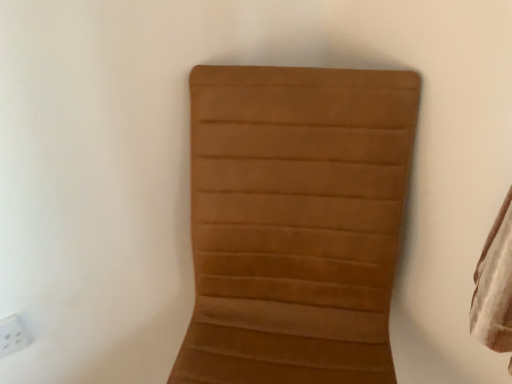
Locate an element on the screen. The image size is (512, 384). brown suede chair at center is located at coordinates (295, 222).

This screenshot has height=384, width=512. What do you see at coordinates (295, 222) in the screenshot?
I see `brown suede chair at center` at bounding box center [295, 222].

In order to click on white plastic electric outlet at lower left in this screenshot , I will do `click(13, 335)`.

The height and width of the screenshot is (384, 512). What do you see at coordinates (13, 335) in the screenshot?
I see `white plastic electric outlet at lower left` at bounding box center [13, 335].

Find the location of a particular element. brown suede chair at center is located at coordinates (295, 222).

Considering the positions of objects white plastic electric outlet at lower left and brown suede chair at center in the image provided, who is more to the right, white plastic electric outlet at lower left or brown suede chair at center?

brown suede chair at center is more to the right.

Does white plastic electric outlet at lower left come in front of brown suede chair at center?

No, it is not.

Which point is more distant from viewer, (x=4, y=343) or (x=371, y=107)?

The point (x=4, y=343) is more distant.

From the image's perspective, is white plastic electric outlet at lower left below brown suede chair at center?

No, from the image's perspective, white plastic electric outlet at lower left is not below brown suede chair at center.

From the picture: From a real-world perspective, is white plastic electric outlet at lower left above or below brown suede chair at center?

white plastic electric outlet at lower left is above brown suede chair at center.

Between white plastic electric outlet at lower left and brown suede chair at center, which one has larger width?

With larger width is brown suede chair at center.

Which of these two, white plastic electric outlet at lower left or brown suede chair at center, stands taller?

brown suede chair at center.

Considering the relative sizes of white plastic electric outlet at lower left and brown suede chair at center in the image provided, is white plastic electric outlet at lower left smaller than brown suede chair at center?

Correct, white plastic electric outlet at lower left occupies less space than brown suede chair at center.

Can we say white plastic electric outlet at lower left lies outside brown suede chair at center?

Yes, white plastic electric outlet at lower left is located beyond the bounds of brown suede chair at center.

Is white plastic electric outlet at lower left beside brown suede chair at center?

Result: No, white plastic electric outlet at lower left is not in contact with brown suede chair at center.

Could you tell me if white plastic electric outlet at lower left is facing brown suede chair at center?

No, white plastic electric outlet at lower left is not turned towards brown suede chair at center.

At what (x,y) coordinates should I click in order to perform the action: click on electric outlet on the left of brown suede chair at center. Please return your answer as a coordinate pair (x, y). The image size is (512, 384). Looking at the image, I should click on (13, 335).

Is brown suede chair at center to the right of white plastic electric outlet at lower left from the viewer's perspective?

Yes, brown suede chair at center is to the right of white plastic electric outlet at lower left.

Between brown suede chair at center and white plastic electric outlet at lower left, which one is positioned behind?

white plastic electric outlet at lower left is more distant.

Is point (277, 118) closer to viewer compared to point (12, 329)?

Yes, point (277, 118) is in front of point (12, 329).

Based on the photo, from the image's perspective, which object appears higher, brown suede chair at center or white plastic electric outlet at lower left?

white plastic electric outlet at lower left, from the image's perspective.

From a real-world perspective, is brown suede chair at center physically below white plastic electric outlet at lower left?

Yes.

Considering the relative sizes of brown suede chair at center and white plastic electric outlet at lower left in the image provided, is brown suede chair at center thinner than white plastic electric outlet at lower left?

In fact, brown suede chair at center might be wider than white plastic electric outlet at lower left.

Considering the sizes of objects brown suede chair at center and white plastic electric outlet at lower left in the image provided, who is taller, brown suede chair at center or white plastic electric outlet at lower left?

With more height is brown suede chair at center.

Is brown suede chair at center bigger than white plastic electric outlet at lower left?

Yes.

Would you say brown suede chair at center contains white plastic electric outlet at lower left?

No, white plastic electric outlet at lower left is not inside brown suede chair at center.

Would you say brown suede chair at center is a long distance from white plastic electric outlet at lower left?

That's not correct — brown suede chair at center is a little close to white plastic electric outlet at lower left.

Is brown suede chair at center positioned with its back to white plastic electric outlet at lower left?

No, white plastic electric outlet at lower left is not at the back of brown suede chair at center.

Can you tell me how much brown suede chair at center and white plastic electric outlet at lower left differ in facing direction?

There is a 39.9-degree angle between the facing directions of brown suede chair at center and white plastic electric outlet at lower left.

Measure the distance between brown suede chair at center and white plastic electric outlet at lower left.

They are 22.78 inches apart.

The image size is (512, 384). I want to click on electric outlet above the brown suede chair at center (from a real-world perspective), so click(x=13, y=335).

Find the location of `electric outlet located above the brown suede chair at center (from the image's perspective)`. electric outlet located above the brown suede chair at center (from the image's perspective) is located at coordinates (13, 335).

The width and height of the screenshot is (512, 384). In order to click on furniture located in front of the white plastic electric outlet at lower left in this screenshot , I will do `click(295, 222)`.